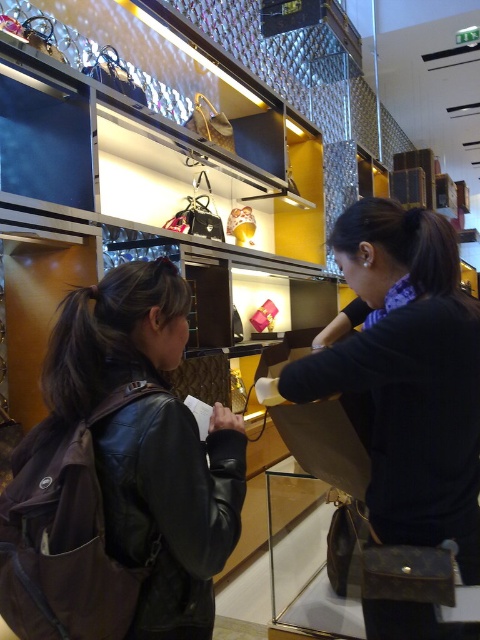
Question: Which of the following is the closest to the observer?

Choices:
 (A) leather jacket at center
 (B) black leather jacket at lower left

Answer: (B)

Question: Is black leather jacket at lower left behind leather jacket at center?

Choices:
 (A) no
 (B) yes

Answer: (A)

Question: Is black leather jacket at lower left positioned behind leather jacket at center?

Choices:
 (A) no
 (B) yes

Answer: (A)

Question: Does black leather jacket at lower left appear on the left side of leather jacket at center?

Choices:
 (A) no
 (B) yes

Answer: (B)